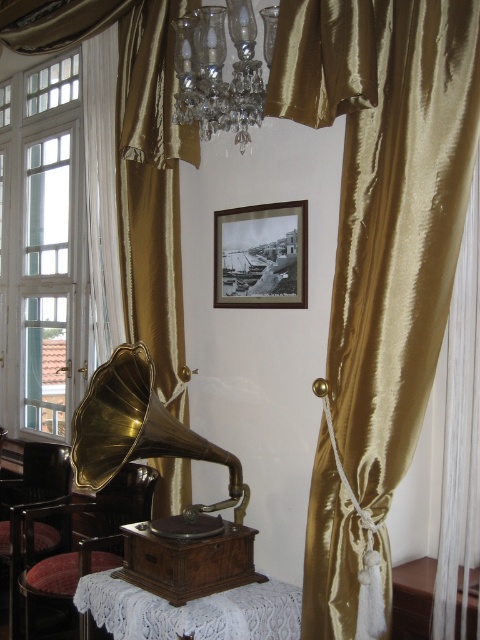
Question: Estimate the real-world distances between objects in this image. Which object is farther from the velvet red chair at lower left?

Choices:
 (A) gold silk curtain at right
 (B) gold satin curtain at center

Answer: (A)

Question: Which object is positioned closest to the gold silk curtain at right?

Choices:
 (A) velvet red chair at lower left
 (B) white lace table at lower center

Answer: (B)

Question: Does gold satin curtain at center have a lesser width compared to white lace table at center?

Choices:
 (A) no
 (B) yes

Answer: (A)

Question: Does gold silk curtain at right lie in front of clear glass window at upper left?

Choices:
 (A) no
 (B) yes

Answer: (B)

Question: Which of the following is the closest to the observer?

Choices:
 (A) (12, 138)
 (B) (195, 58)
 (C) (73, 65)
 (D) (100, 12)

Answer: (B)

Question: Does velvet red chair at lower left appear under white lace table at lower center?

Choices:
 (A) yes
 (B) no

Answer: (A)